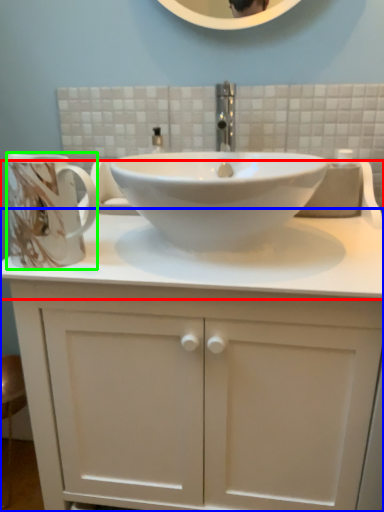
Question: Considering the real-world distances, which object is farthest from counter top (highlighted by a red box)? bathroom cabinet (highlighted by a blue box) or mug (highlighted by a green box)?

Choices:
 (A) bathroom cabinet
 (B) mug

Answer: (B)